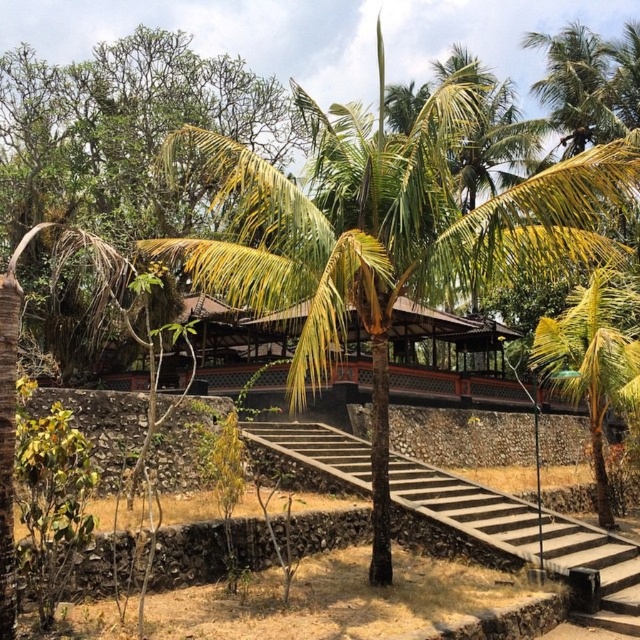
Question: Is green leafy palm tree at center in front of green leafy palm tree at right?

Choices:
 (A) no
 (B) yes

Answer: (B)

Question: Can you confirm if brown wooden stairs at center is smaller than green leafy palm tree at right?

Choices:
 (A) no
 (B) yes

Answer: (B)

Question: Can you confirm if green leafy palm tree at center is wider than green leafy palm tree at right?

Choices:
 (A) no
 (B) yes

Answer: (B)

Question: Which of the following is the closest to the observer?

Choices:
 (A) green leafy palm tree at center
 (B) brown wooden stairs at center
 (C) green leafy palm tree at right

Answer: (A)

Question: Which of the following is the farthest from the observer?

Choices:
 (A) green leafy palm tree at right
 (B) brown wooden stairs at center
 (C) green leafy palm tree at center

Answer: (A)

Question: Which point is closer to the camera?

Choices:
 (A) (524, 244)
 (B) (584, 400)
 (C) (314, 428)

Answer: (A)